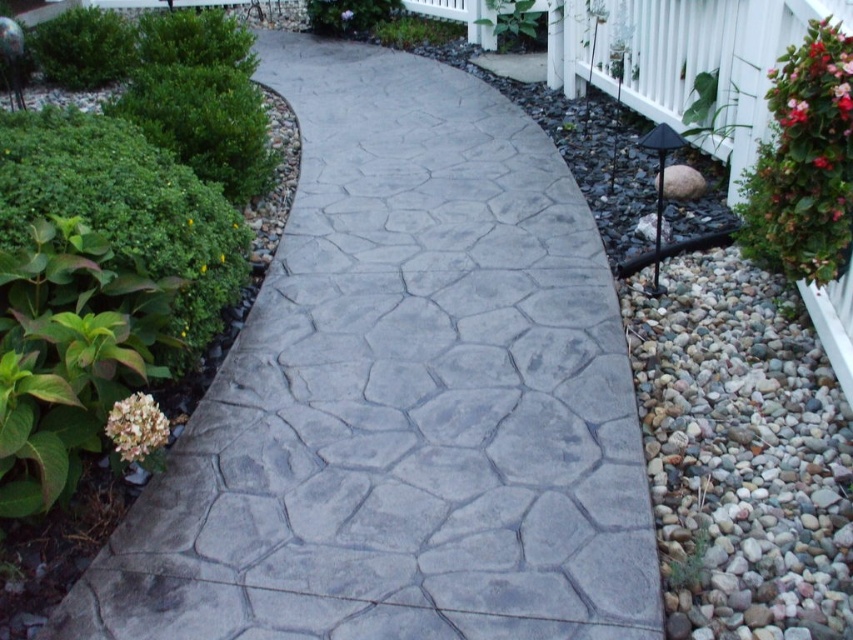
Can you confirm if green leafy plant at upper center is taller than red glossy flower at upper right?

Yes, green leafy plant at upper center is taller than red glossy flower at upper right.

Is the position of green leafy plant at upper center less distant than that of red glossy flower at upper right?

No, it is behind red glossy flower at upper right.

Locate an element on the screen. This screenshot has width=853, height=640. green leafy plant at upper center is located at coordinates (416, 29).

Can you confirm if green leafy bush at upper right is positioned to the right of white matte flower at lower left?

Indeed, green leafy bush at upper right is positioned on the right side of white matte flower at lower left.

This screenshot has height=640, width=853. Describe the element at coordinates (804, 163) in the screenshot. I see `green leafy bush at upper right` at that location.

At what (x,y) coordinates should I click in order to perform the action: click on green leafy bush at upper right. Please return your answer as a coordinate pair (x, y). The height and width of the screenshot is (640, 853). Looking at the image, I should click on (804, 163).

Does white matte flower at lower left appear under red matte flower at upper right?

Indeed, white matte flower at lower left is positioned under red matte flower at upper right.

This screenshot has height=640, width=853. Describe the element at coordinates (136, 428) in the screenshot. I see `white matte flower at lower left` at that location.

Find the location of a particular element. The width and height of the screenshot is (853, 640). white matte flower at lower left is located at coordinates (136, 428).

Where is `white matte flower at lower left`? This screenshot has width=853, height=640. white matte flower at lower left is located at coordinates (136, 428).